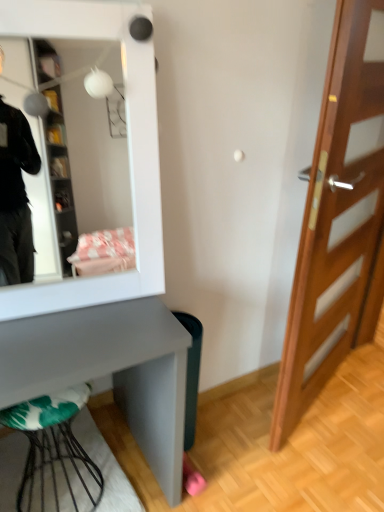
The height and width of the screenshot is (512, 384). I want to click on free location to the right of green plastic trash bin at lower right, so click(229, 433).